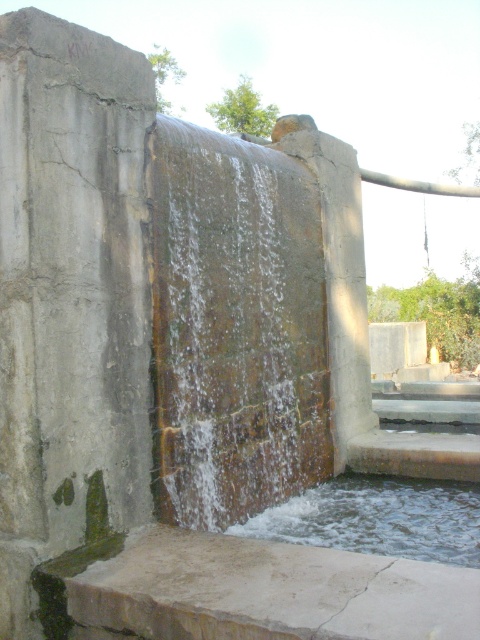
You are standing near the waterfall and want to place a small potted plant on the smooth concrete slab at lower center. However, you need to ensure it won not fall into the clear water at bottom. Is the slab a safe place to put the plant?

The smooth concrete slab at lower center is positioned over clear water at bottom, so placing the plant there may be risky as the slab is above the water and could potentially allow the plant to fall in.

You are standing at the edge of the waterfall and want to step onto the smooth concrete slab at lower center. However, you need to know if it is larger than the clear water at bottom to ensure safety. Can you confirm which one is bigger?

The smooth concrete slab at lower center is bigger than clear water at bottom, so it is larger and safer to step onto.

You are standing at the base of the waterfall and want to place a small potted plant on the smooth concrete slab at lower center. However, you need to ensure that the clear water at bottom won

The smooth concrete slab at lower center is closer to the viewer than the clear water at bottom, so placing the potted plant there would keep it above the water level and prevent it from getting soaked.